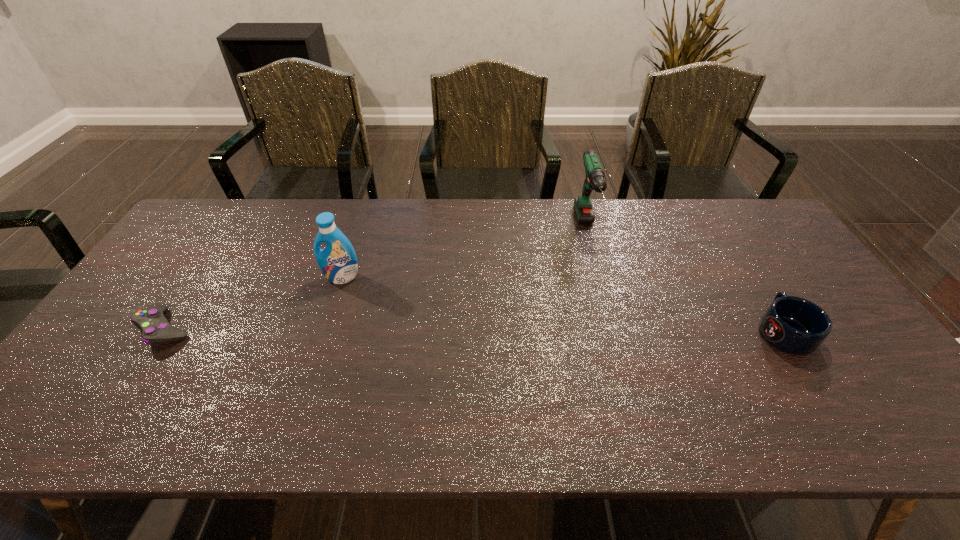
The height and width of the screenshot is (540, 960). Identify the location of vacant space that's between the detergent and the leftmost object. (253, 303).

In order to click on free area in between the farthest object and the mug in this screenshot , I will do `click(685, 279)`.

Where is `object that stands as the third closest to the control`? The height and width of the screenshot is (540, 960). object that stands as the third closest to the control is located at coordinates (794, 325).

Identify which object is located as the nearest to the farthest object. Please provide its 2D coordinates. Your answer should be formatted as a tuple, i.e. [(x, y)], where the tuple contains the x and y coordinates of a point satisfying the conditions above.

[(794, 325)]